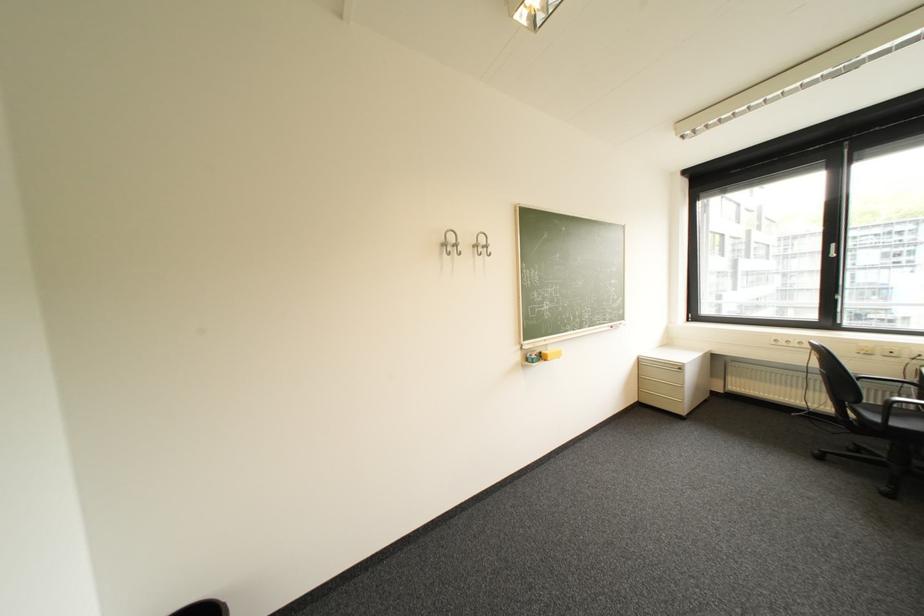
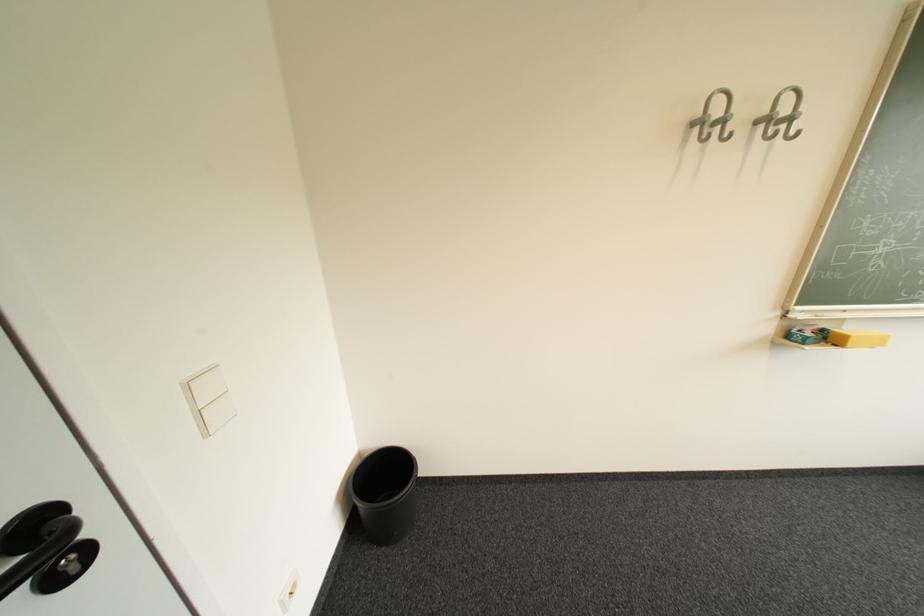
How did the camera likely rotate?

The camera's rotation is toward left-down.